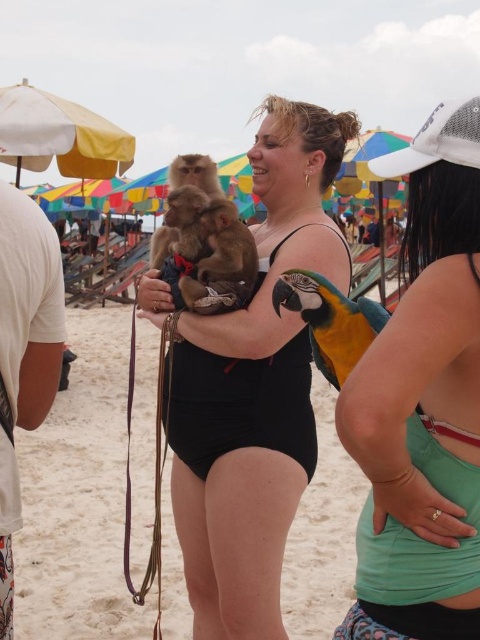
You are a photographer trying to capture a photo of the brown fur monkey at center and the teal fabric tank top at right. Based on their positions, which object is located on the right side of the scene?

The teal fabric tank top at right is located to the right of the brown fur monkey at center, so the teal fabric tank top at right is on the right side of the scene.

You are a photographer trying to capture a closeup shot of the teal fabric tank top at right and the brown fur monkey at center. Since you want both subjects to be in focus, you need to know which one is wider. Which object has a smaller width?

The teal fabric tank top at right has a lesser width compared to the brown fur monkey at center, so the teal fabric tank top at right is the narrower object.